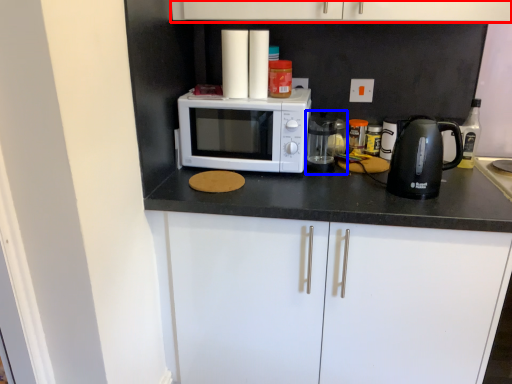
Question: Which point is closer to the camera, cabinetry (highlighted by a red box) or appliance (highlighted by a blue box)?

Choices:
 (A) cabinetry
 (B) appliance

Answer: (A)